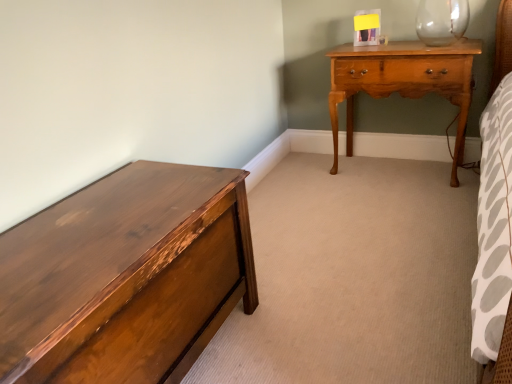
This screenshot has width=512, height=384. Describe the element at coordinates (125, 276) in the screenshot. I see `shiny brown wood chest of drawers at left` at that location.

Identify the location of shiny brown wood chest of drawers at left. This screenshot has height=384, width=512. (125, 276).

The height and width of the screenshot is (384, 512). Find the location of `light brown wood nightstand at upper right`. light brown wood nightstand at upper right is located at coordinates (403, 81).

This screenshot has height=384, width=512. Describe the element at coordinates (403, 81) in the screenshot. I see `light brown wood nightstand at upper right` at that location.

What is the approximate height of light brown wood nightstand at upper right?

27.63 inches.

Locate an element on the screen. The height and width of the screenshot is (384, 512). shiny brown wood chest of drawers at left is located at coordinates (125, 276).

Considering the relative positions of shiny brown wood chest of drawers at left and light brown wood nightstand at upper right in the image provided, is shiny brown wood chest of drawers at left to the left or to the right of light brown wood nightstand at upper right?

shiny brown wood chest of drawers at left is positioned on light brown wood nightstand at upper right's left side.

Who is more distant, shiny brown wood chest of drawers at left or light brown wood nightstand at upper right?

light brown wood nightstand at upper right.

Does point (164, 188) appear closer or farther from the camera than point (394, 70)?

Point (164, 188) is positioned closer to the camera compared to point (394, 70).

From the image's perspective, is shiny brown wood chest of drawers at left located above or below light brown wood nightstand at upper right?

shiny brown wood chest of drawers at left is situated lower than light brown wood nightstand at upper right in the image.

From a real-world perspective, is shiny brown wood chest of drawers at left over light brown wood nightstand at upper right?

No.

Considering the relative sizes of shiny brown wood chest of drawers at left and light brown wood nightstand at upper right in the image provided, is shiny brown wood chest of drawers at left wider than light brown wood nightstand at upper right?

Yes.

Which of these two, shiny brown wood chest of drawers at left or light brown wood nightstand at upper right, stands taller?

Standing taller between the two is light brown wood nightstand at upper right.

Can you confirm if shiny brown wood chest of drawers at left is smaller than light brown wood nightstand at upper right?

Actually, shiny brown wood chest of drawers at left might be larger than light brown wood nightstand at upper right.

Is shiny brown wood chest of drawers at left inside the boundaries of light brown wood nightstand at upper right, or outside?

The correct answer is: outside.

Are shiny brown wood chest of drawers at left and light brown wood nightstand at upper right far apart?

Yes, shiny brown wood chest of drawers at left and light brown wood nightstand at upper right are quite far apart.

Is shiny brown wood chest of drawers at left facing away from light brown wood nightstand at upper right?

No, shiny brown wood chest of drawers at left is not facing away from light brown wood nightstand at upper right.

At what (x,y) coordinates should I click in order to perform the action: click on nightstand behind the shiny brown wood chest of drawers at left. Please return your answer as a coordinate pair (x, y). This screenshot has width=512, height=384. Looking at the image, I should click on (403, 81).

Visually, is light brown wood nightstand at upper right positioned to the left or to the right of shiny brown wood chest of drawers at left?

light brown wood nightstand at upper right is to the right of shiny brown wood chest of drawers at left.

Which object is further away from the camera taking this photo, light brown wood nightstand at upper right or shiny brown wood chest of drawers at left?

light brown wood nightstand at upper right is further from the camera.

Which point is more forward, (333, 166) or (93, 235)?

The point (93, 235) is closer to the camera.

From the image's perspective, is light brown wood nightstand at upper right on top of shiny brown wood chest of drawers at left?

Correct, light brown wood nightstand at upper right appears higher than shiny brown wood chest of drawers at left in the image.

From a real-world perspective, relative to shiny brown wood chest of drawers at left, is light brown wood nightstand at upper right vertically above or below?

From a real-world perspective, light brown wood nightstand at upper right is physically above shiny brown wood chest of drawers at left.

Is light brown wood nightstand at upper right thinner than shiny brown wood chest of drawers at left?

Correct, the width of light brown wood nightstand at upper right is less than that of shiny brown wood chest of drawers at left.

Considering the sizes of objects light brown wood nightstand at upper right and shiny brown wood chest of drawers at left in the image provided, who is shorter, light brown wood nightstand at upper right or shiny brown wood chest of drawers at left?

Standing shorter between the two is shiny brown wood chest of drawers at left.

Who is bigger, light brown wood nightstand at upper right or shiny brown wood chest of drawers at left?

With larger size is shiny brown wood chest of drawers at left.

Could shiny brown wood chest of drawers at left be considered to be inside light brown wood nightstand at upper right?

No, shiny brown wood chest of drawers at left is not a part of light brown wood nightstand at upper right.

Is there a large distance between light brown wood nightstand at upper right and shiny brown wood chest of drawers at left?

Absolutely, light brown wood nightstand at upper right is distant from shiny brown wood chest of drawers at left.

Consider the image. Is light brown wood nightstand at upper right positioned with its back to shiny brown wood chest of drawers at left?

No, shiny brown wood chest of drawers at left is not at the back of light brown wood nightstand at upper right.

The width and height of the screenshot is (512, 384). Find the location of `nightstand that appears above the shiny brown wood chest of drawers at left (from the image's perspective)`. nightstand that appears above the shiny brown wood chest of drawers at left (from the image's perspective) is located at coordinates (403, 81).

Where is `the chest of drawers that appears below the light brown wood nightstand at upper right (from a real-world perspective)`? the chest of drawers that appears below the light brown wood nightstand at upper right (from a real-world perspective) is located at coordinates (125, 276).

Find the location of a particular element. The image size is (512, 384). the chest of drawers located below the light brown wood nightstand at upper right (from the image's perspective) is located at coordinates (125, 276).